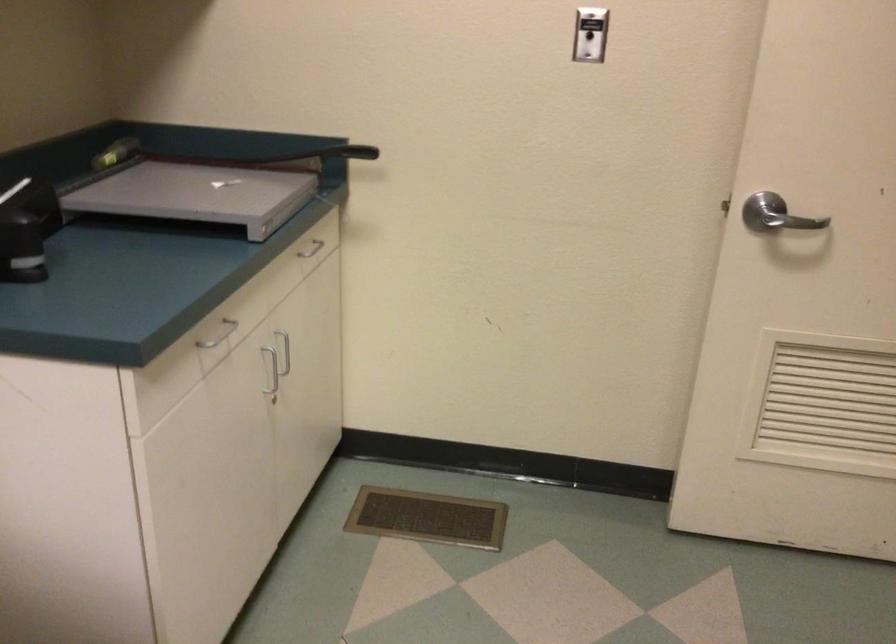
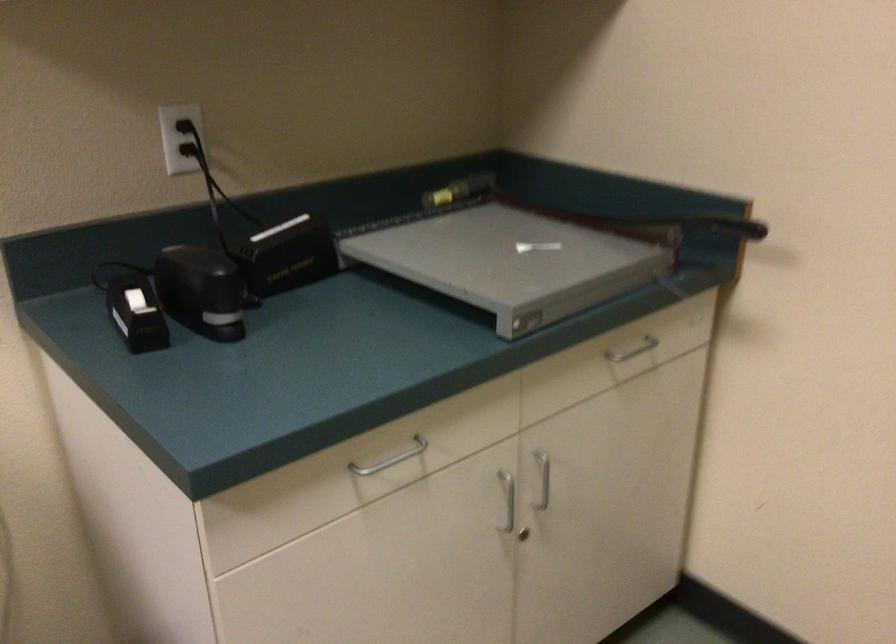
In the second image, find the point that corresponds to [366,149] in the first image.

(742, 228)